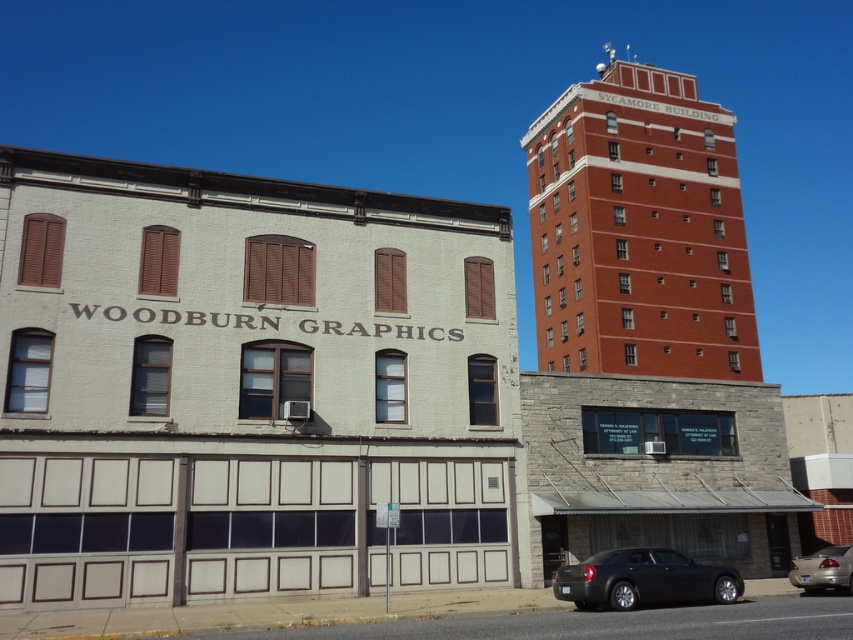
Image resolution: width=853 pixels, height=640 pixels. In order to click on brick building at upper right in this screenshot , I will do `click(637, 230)`.

Is brick building at upper right shorter than black matte sedan at lower center?

No.

Which is behind, point (694, 188) or point (618, 584)?

The point (694, 188) is more distant.

This screenshot has width=853, height=640. What are the coordinates of `brick building at upper right` in the screenshot? It's located at (637, 230).

Between black matte sedan at lower center and matte black sedan at lower right, which one has less height?

black matte sedan at lower center

Does black matte sedan at lower center have a greater height compared to matte black sedan at lower right?

No.

Measure the distance between point (636, 579) and camera.

The distance of point (636, 579) from camera is 52.18 feet.

Find the location of a particular element. The height and width of the screenshot is (640, 853). black matte sedan at lower center is located at coordinates (643, 579).

Does brick building at upper right have a greater height compared to matte black sedan at lower right?

Correct, brick building at upper right is much taller as matte black sedan at lower right.

The height and width of the screenshot is (640, 853). Describe the element at coordinates (637, 230) in the screenshot. I see `brick building at upper right` at that location.

Who is more forward, (x=720, y=374) or (x=815, y=560)?

Point (x=815, y=560) is in front.

Identify the location of brick building at upper right. The width and height of the screenshot is (853, 640). point(637,230).